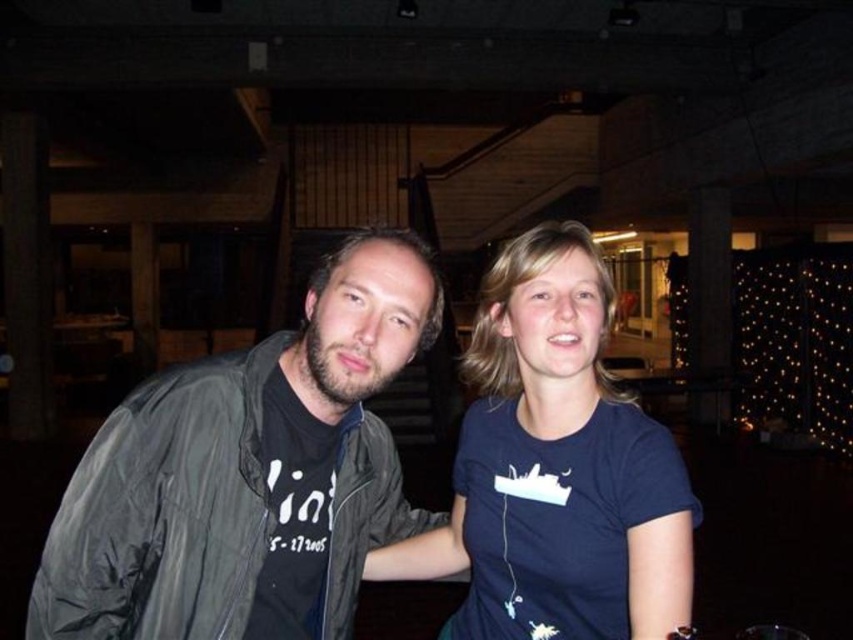
Question: Does dark gray jacket at center appear on the left side of dark blue t-shirt at center?

Choices:
 (A) no
 (B) yes

Answer: (B)

Question: Which point is farther from the camera taking this photo?

Choices:
 (A) (589, 392)
 (B) (204, 593)

Answer: (A)

Question: Is dark gray jacket at center positioned in front of dark blue t-shirt at center?

Choices:
 (A) no
 (B) yes

Answer: (A)

Question: Can you confirm if dark gray jacket at center is bigger than dark blue t-shirt at center?

Choices:
 (A) yes
 (B) no

Answer: (B)